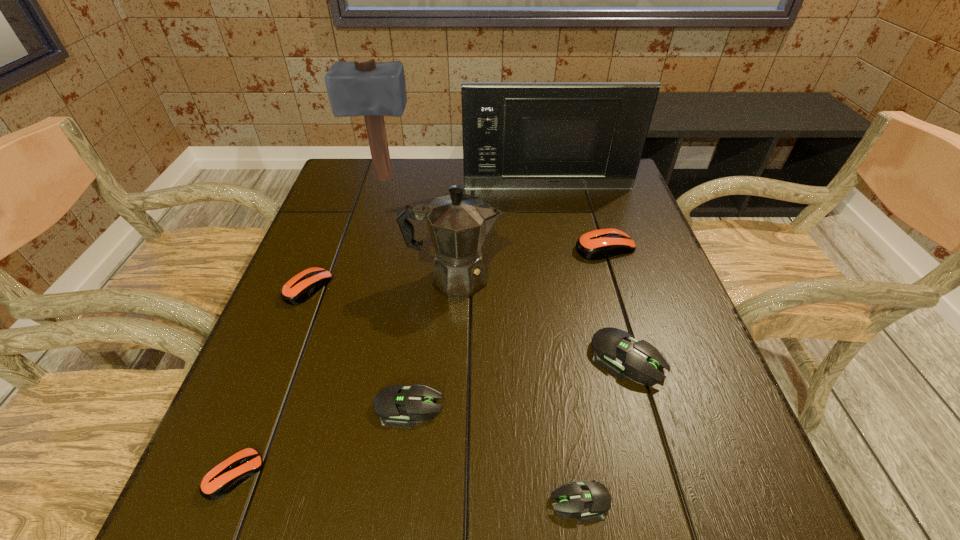
Locate an element on the screen. brown mallet is located at coordinates (364, 88).

The width and height of the screenshot is (960, 540). In order to click on microwave oven in this screenshot , I will do `click(585, 136)`.

In order to click on coffeepot in this screenshot , I will do `click(458, 223)`.

Identify the location of the rightmost orange computer mouse. The height and width of the screenshot is (540, 960). (599, 244).

Find the location of a particular element. the biggest orange computer mouse is located at coordinates (599, 244).

Image resolution: width=960 pixels, height=540 pixels. I want to click on the biggest gray computer mouse, so click(615, 350).

You are a GUI agent. You are given a task and a screenshot of the screen. Output one action in this format:
    pyautogui.click(x=<x>, y=<y>)
    Task: Click on the fifth nearest computer mouse
    The width and height of the screenshot is (960, 540).
    Given the screenshot: What is the action you would take?
    pyautogui.click(x=301, y=287)

You are a GUI agent. You are given a task and a screenshot of the screen. Output one action in this format:
    pyautogui.click(x=<x>, y=<y>)
    Task: Click on the second nearest orange computer mouse
    The image size is (960, 540).
    Given the screenshot: What is the action you would take?
    pyautogui.click(x=301, y=287)

The image size is (960, 540). Identify the location of the third computer mouse from left to right. (395, 405).

The height and width of the screenshot is (540, 960). I want to click on the leftmost gray computer mouse, so click(395, 405).